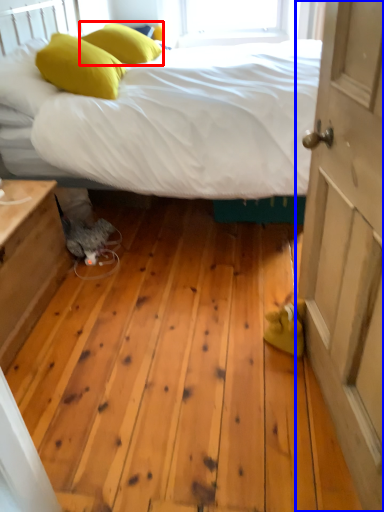
Question: Which object is further to the camera taking this photo, pillow (highlighted by a red box) or door (highlighted by a blue box)?

Choices:
 (A) pillow
 (B) door

Answer: (A)